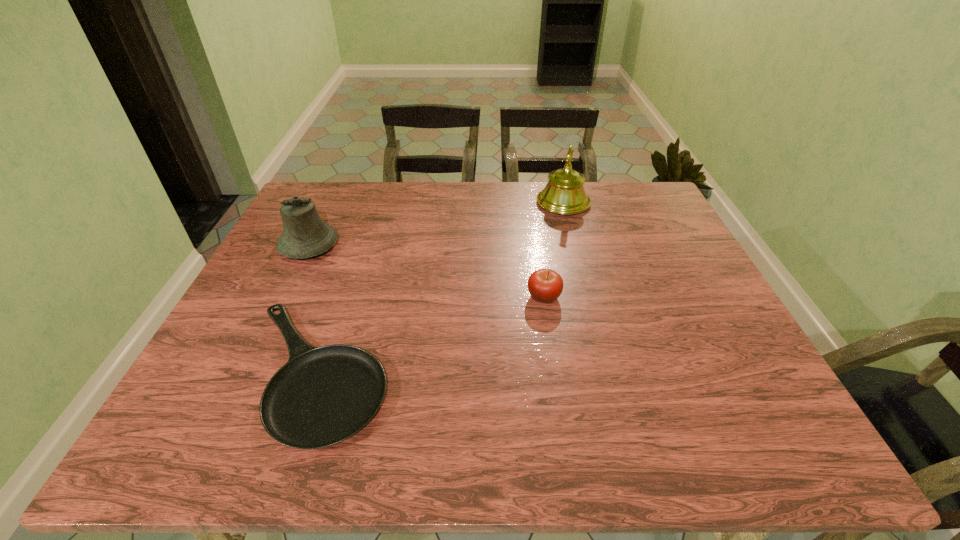
Locate an element on the screen. free space at the right edge is located at coordinates (697, 318).

You are a GUI agent. You are given a task and a screenshot of the screen. Output one action in this format:
    pyautogui.click(x=<x>, y=<y>)
    Task: Click on the free region at the near left corner of the desktop
    
    Given the screenshot: What is the action you would take?
    pyautogui.click(x=180, y=449)

You are a GUI agent. You are given a task and a screenshot of the screen. Output one action in this format:
    pyautogui.click(x=<x>, y=<y>)
    Task: Click on the vacant space at the far right corner of the desktop
    This screenshot has width=960, height=540.
    Given the screenshot: What is the action you would take?
    pyautogui.click(x=652, y=190)

Where is `vacant space at the near right corner of the desktop`? This screenshot has width=960, height=540. vacant space at the near right corner of the desktop is located at coordinates (758, 423).

Locate an element on the screen. This screenshot has width=960, height=540. unoccupied position between the frying pan and the third shortest object is located at coordinates (313, 309).

Where is `vacant space that's between the third nearest object and the apple`? This screenshot has height=540, width=960. vacant space that's between the third nearest object and the apple is located at coordinates (426, 271).

Locate an element on the screen. The height and width of the screenshot is (540, 960). free spot between the left bell and the frying pan is located at coordinates (313, 309).

Identify the location of empty space that is in between the nearest object and the second tallest object. The image size is (960, 540). coord(313,309).

You are a GUI agent. You are given a task and a screenshot of the screen. Output one action in this format:
    pyautogui.click(x=<x>, y=<y>)
    Task: Click on the empty space that is in between the second shortest object and the frying pan
    The width and height of the screenshot is (960, 540).
    Given the screenshot: What is the action you would take?
    pyautogui.click(x=430, y=334)

Locate an element on the screen. The width and height of the screenshot is (960, 540). free space between the nearest object and the third nearest object is located at coordinates (313, 309).